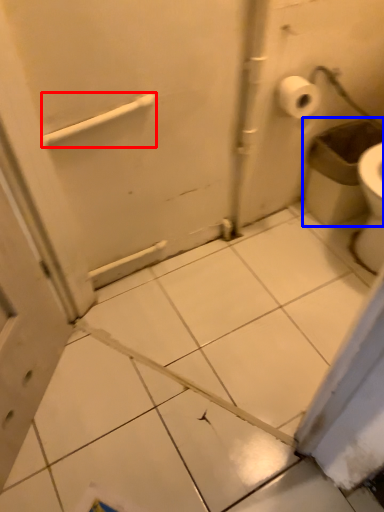
Question: Which object appears closest to the camera in this image, towel bar (highlighted by a red box) or garbage (highlighted by a blue box)?

Choices:
 (A) towel bar
 (B) garbage

Answer: (A)